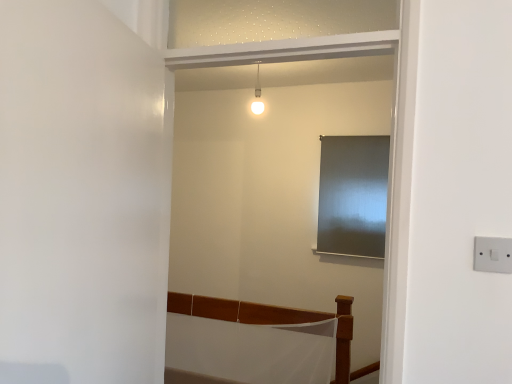
Locate an element on the screen. This screenshot has height=384, width=512. white plastic switch at right is located at coordinates (493, 254).

The height and width of the screenshot is (384, 512). I want to click on white matte door at left, so click(82, 191).

Identify the location of white glossy light fixture at upper center. This screenshot has height=384, width=512. (257, 95).

Locate an element on the screen. The width and height of the screenshot is (512, 384). white plastic switch at right is located at coordinates (493, 254).

How distant is satin silver curtain at center from wooden bed frame at lower center?

3.29 feet.

Can you tell me how much satin silver curtain at center and wooden bed frame at lower center differ in facing direction?

satin silver curtain at center and wooden bed frame at lower center are facing 0.000214 degrees away from each other.

Is point (380, 253) closer or farther from the camera than point (246, 306)?

Clearly, point (380, 253) is more distant from the camera than point (246, 306).

Is satin silver curtain at center oriented away from wooden bed frame at lower center?

No.

Does white plastic switch at right contain satin silver curtain at center?

No, satin silver curtain at center is not a part of white plastic switch at right.

Is white plastic switch at right far away from satin silver curtain at center?

white plastic switch at right is positioned a significant distance from satin silver curtain at center.

From their relative heights in the image, would you say white plastic switch at right is taller or shorter than satin silver curtain at center?

In the image, white plastic switch at right appears to be shorter than satin silver curtain at center.

Is white plastic switch at right thinner than satin silver curtain at center?

Correct, the width of white plastic switch at right is less than that of satin silver curtain at center.

Could white matte door at left be considered to be inside wooden bed frame at lower center?

No, white matte door at left is not inside wooden bed frame at lower center.

How different are the orientations of wooden bed frame at lower center and white matte door at left in degrees?

102 degrees.

Considering the relative sizes of wooden bed frame at lower center and white matte door at left in the image provided, is wooden bed frame at lower center thinner than white matte door at left?

No, wooden bed frame at lower center is not thinner than white matte door at left.

From the image's perspective, which one is positioned higher, wooden bed frame at lower center or white matte door at left?

white matte door at left, from the image's perspective.

Considering the points (256, 98) and (121, 63), which point is in front, point (256, 98) or point (121, 63)?

The point (121, 63) is in front.

From the image's perspective, which one is positioned lower, white glossy light fixture at upper center or white matte door at left?

From the image's view, white matte door at left is below.

Considering the relative positions of white glossy light fixture at upper center and white matte door at left in the image provided, is white glossy light fixture at upper center behind white matte door at left?

Yes, it is.

How different are the orientations of white glossy light fixture at upper center and white matte door at left in degrees?

white glossy light fixture at upper center and white matte door at left are facing 98.7 degrees away from each other.

Between white matte door at left and white plastic switch at right, which one has larger size?

With larger size is white matte door at left.

Which object is thinner, white matte door at left or white plastic switch at right?

white plastic switch at right is thinner.

Is the depth of white matte door at left less than that of white plastic switch at right?

Yes, it is in front of white plastic switch at right.

Which point is more distant from viewer, (99, 334) or (510, 240)?

Positioned behind is point (510, 240).

Identify the location of light fixture above the white plastic switch at right (from a real-world perspective). (257, 95).

From the image's perspective, which one is positioned higher, white plastic switch at right or white glossy light fixture at upper center?

white glossy light fixture at upper center.

Is white plastic switch at right positioned far away from white glossy light fixture at upper center?

Yes, white plastic switch at right is far from white glossy light fixture at upper center.

From the picture: Does white plastic switch at right come behind white glossy light fixture at upper center?

That is False.

Locate an element on the screen. electric outlet on the right of wooden bed frame at lower center is located at coordinates (493, 254).

From the image's perspective, which is below, wooden bed frame at lower center or white plastic switch at right?

From the image's view, wooden bed frame at lower center is below.

Considering the sizes of wooden bed frame at lower center and white plastic switch at right in the image, is wooden bed frame at lower center wider or thinner than white plastic switch at right?

Considering their sizes, wooden bed frame at lower center looks broader than white plastic switch at right.

Could you tell me if wooden bed frame at lower center is turned towards white plastic switch at right?

No.

Image resolution: width=512 pixels, height=384 pixels. In order to click on window lying above the wooden bed frame at lower center (from the image's perspective) in this screenshot , I will do `click(353, 195)`.

Identify the location of window that is on the right side of white plastic switch at right. (353, 195).

Estimate the real-world distances between objects in this image. Which object is further from white matte door at left, white plastic switch at right or white glossy light fixture at upper center?

white glossy light fixture at upper center is further to white matte door at left.

From the image, which object appears to be nearer to white matte door at left, satin silver curtain at center or white glossy light fixture at upper center?

white glossy light fixture at upper center is positioned closer to the anchor white matte door at left.

Estimate the real-world distances between objects in this image. Which object is further from satin silver curtain at center, white matte door at left or white plastic switch at right?

white matte door at left is further to satin silver curtain at center.

Estimate the real-world distances between objects in this image. Which object is closer to white glossy light fixture at upper center, white plastic switch at right or satin silver curtain at center?

satin silver curtain at center lies closer to white glossy light fixture at upper center than the other object.

In the scene shown: When comparing their distances from white matte door at left, does white glossy light fixture at upper center or white plastic switch at right seem further?

Among the two, white glossy light fixture at upper center is located further to white matte door at left.

Considering their positions, is white matte door at left positioned further to wooden bed frame at lower center than satin silver curtain at center?

white matte door at left is positioned further to the anchor wooden bed frame at lower center.

Considering their positions, is white plastic switch at right positioned closer to satin silver curtain at center than white glossy light fixture at upper center?

The object closer to satin silver curtain at center is white glossy light fixture at upper center.

Looking at the image, which one is located further to satin silver curtain at center, white plastic switch at right or white matte door at left?

white matte door at left is further to satin silver curtain at center.

Identify the location of furniture positioned between white matte door at left and satin silver curtain at center from near to far. (252, 342).

Where is `electric outlet between white glossy light fixture at upper center and wooden bed frame at lower center vertically`? The image size is (512, 384). electric outlet between white glossy light fixture at upper center and wooden bed frame at lower center vertically is located at coordinates (493, 254).

This screenshot has width=512, height=384. I want to click on furniture positioned between white matte door at left and white glossy light fixture at upper center from near to far, so click(x=252, y=342).

Find the location of a particular element. The height and width of the screenshot is (384, 512). light fixture positioned between white matte door at left and satin silver curtain at center from near to far is located at coordinates (257, 95).